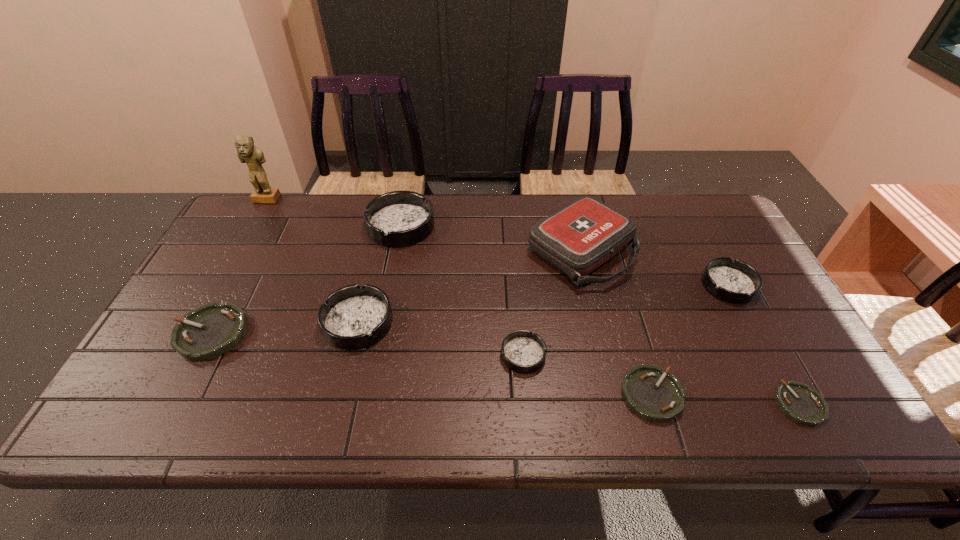
At what (x,y) coordinates should I click in order to perform the action: click on the second closest ashtray relative to the second shortest object. Please return your answer as a coordinate pair (x, y). The image size is (960, 540). Looking at the image, I should click on (796, 400).

Image resolution: width=960 pixels, height=540 pixels. Find the location of `the third closest dark ashtray to the third dark ashtray from left to right`. the third closest dark ashtray to the third dark ashtray from left to right is located at coordinates (737, 282).

Locate an element on the screen. dark ashtray that is the fourth nearest to the smallest green ashtray is located at coordinates (399, 218).

Where is `green ashtray that is the third closest to the second biggest dark ashtray`? Image resolution: width=960 pixels, height=540 pixels. green ashtray that is the third closest to the second biggest dark ashtray is located at coordinates (796, 400).

Point out which green ashtray is positioned as the nearest to the farthest green ashtray. Please provide its 2D coordinates. Your answer should be formatted as a tuple, i.e. [(x, y)], where the tuple contains the x and y coordinates of a point satisfying the conditions above.

[(650, 392)]

This screenshot has height=540, width=960. In order to click on vacant area that satisfies the following two spatial constraints: 1. on the front-facing side of the fourth ashtray from right to left; 2. on the right side of the figurine in this screenshot , I will do `click(180, 355)`.

At what (x,y) coordinates should I click in order to perform the action: click on vacant space that satisfies the following two spatial constraints: 1. on the front-facing side of the tallest object; 2. on the right side of the biggest green ashtray. Please return your answer as a coordinate pair (x, y). This screenshot has width=960, height=540. Looking at the image, I should click on (191, 334).

Image resolution: width=960 pixels, height=540 pixels. I want to click on vacant region that satisfies the following two spatial constraints: 1. on the front side of the first-aid kit; 2. on the right side of the fifth shortest object, so click(x=588, y=285).